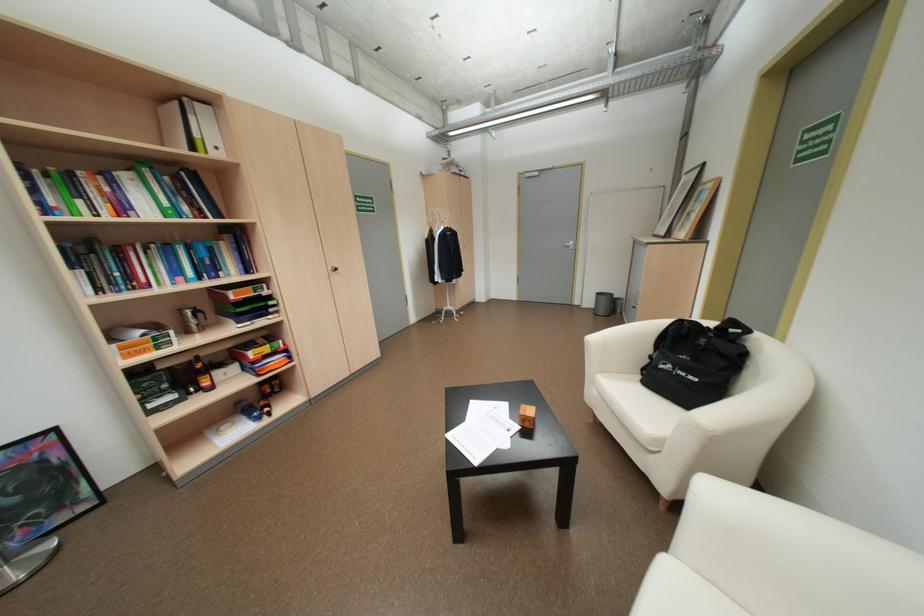
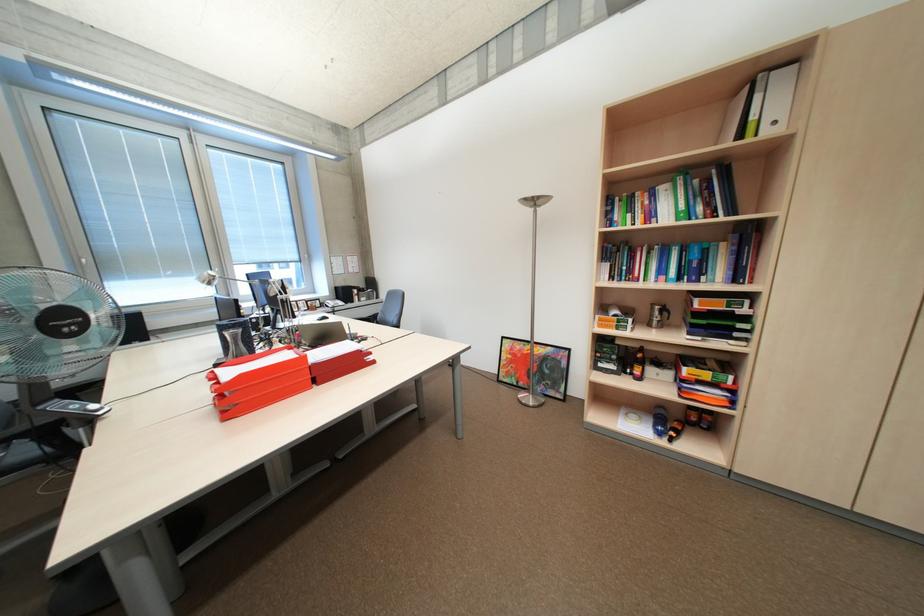
In the second image, find the point that corresponds to (x=190, y=310) in the first image.

(663, 304)